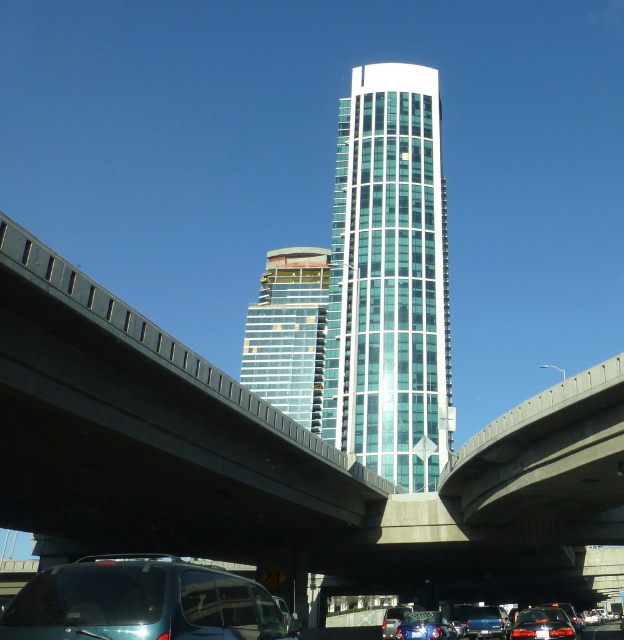
You are a delivery drone that needs to fly under the concrete bridge at center to reach the translucent glass building at center. Can you safely pass underneath the bridge?

The concrete bridge at center has a lesser height compared to the translucent glass building at center. Since the bridge is shorter in height than the building, the drone may not have enough clearance to pass underneath safely. It is recommended to choose an alternative route with sufficient vertical clearance.

You are a delivery driver in a teal glossy minivan at lower left and need to reach the translucent glass building at center for a delivery. The road ahead has a speed limit of 30 km per hour. If your vehicle can accelerate at 2 m per second squared, how long will it take to reach the building?

The distance between the teal glossy minivan at lower left and the translucent glass building at center is 120.61 meters. Using the formula for time when accelerating from rest, t equals square root of 2d over a, where d is distance and a is acceleration. Plugging in the numbers, t equals sqrt of 2 times 120.61 divided by 2, which is sqrt of 120.61, approximately 11 seconds. However, the speed limit is 30 km per hour, which is about 8.33 meters per second. The acceleration time to reach that speed would be